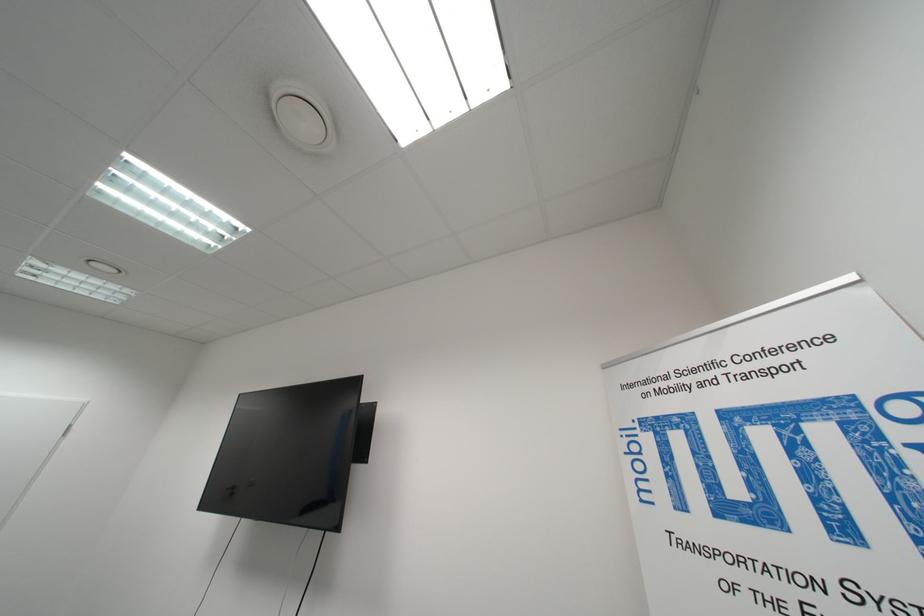
Where is `silver banner rail`? Image resolution: width=924 pixels, height=616 pixels. silver banner rail is located at coordinates (747, 315).